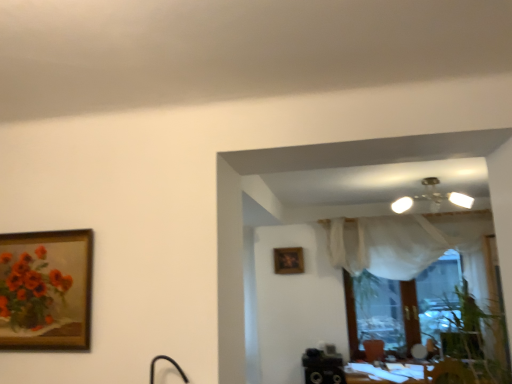
Question: Is wooden frame at center wider than matte floral painting at left?

Choices:
 (A) yes
 (B) no

Answer: (A)

Question: Is wooden frame at center closer to the viewer compared to matte floral painting at left?

Choices:
 (A) yes
 (B) no

Answer: (B)

Question: Is wooden frame at center turned away from matte floral painting at left?

Choices:
 (A) no
 (B) yes

Answer: (A)

Question: Does wooden frame at center lie behind matte floral painting at left?

Choices:
 (A) no
 (B) yes

Answer: (B)

Question: From the image's perspective, is wooden frame at center above matte floral painting at left?

Choices:
 (A) yes
 (B) no

Answer: (B)

Question: Is wooden frame at center bigger or smaller than matte floral painting at left?

Choices:
 (A) small
 (B) big

Answer: (A)

Question: Is wooden frame at center inside the boundaries of matte floral painting at left, or outside?

Choices:
 (A) inside
 (B) outside

Answer: (B)

Question: In terms of height, does wooden frame at center look taller or shorter compared to matte floral painting at left?

Choices:
 (A) tall
 (B) short

Answer: (B)

Question: Looking at their shapes, would you say wooden frame at center is wider or thinner than matte floral painting at left?

Choices:
 (A) wide
 (B) thin

Answer: (A)

Question: Looking at the image, does matte floral painting at left seem bigger or smaller compared to white glossy table at lower right?

Choices:
 (A) small
 (B) big

Answer: (A)

Question: Does point (54, 279) appear closer or farther from the camera than point (373, 382)?

Choices:
 (A) closer
 (B) farther

Answer: (A)

Question: From a real-world perspective, is matte floral painting at left above or below white glossy table at lower right?

Choices:
 (A) above
 (B) below

Answer: (A)

Question: Is matte floral painting at left wider or thinner than white glossy table at lower right?

Choices:
 (A) wide
 (B) thin

Answer: (B)

Question: Considering the positions of matte floral painting at left and wooden frame at center in the image, is matte floral painting at left taller or shorter than wooden frame at center?

Choices:
 (A) short
 (B) tall

Answer: (B)

Question: From the image's perspective, is matte floral painting at left above or below wooden frame at center?

Choices:
 (A) above
 (B) below

Answer: (A)